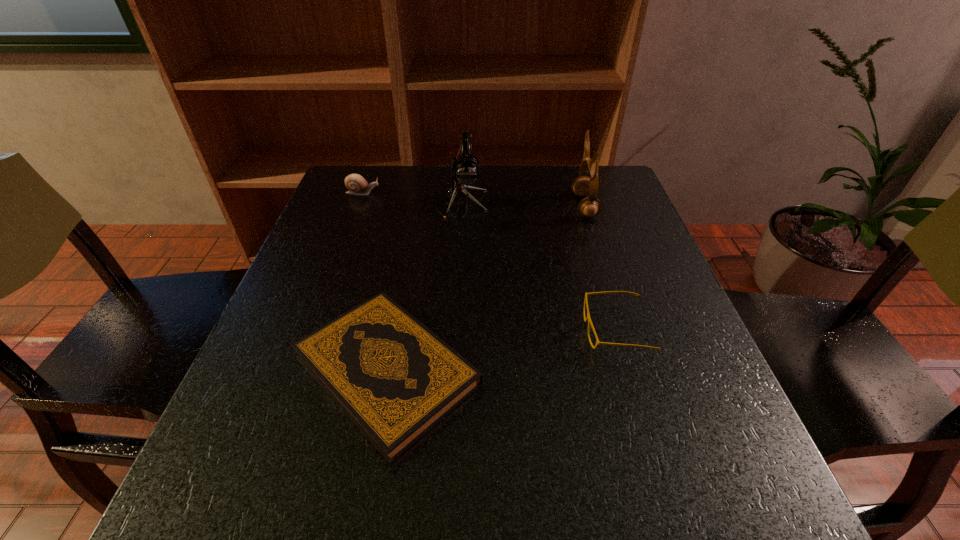
Identify the location of free region that satisfies the following two spatial constraints: 1. on the front-facing side of the escargot; 2. on the right side of the left earphone. (358, 205).